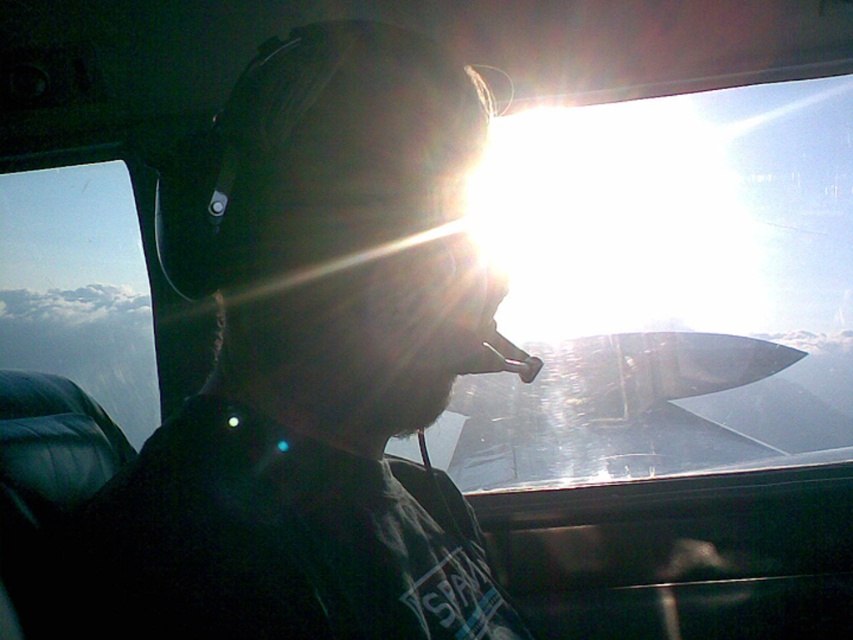
You are a GUI agent. You are given a task and a screenshot of the screen. Output one action in this format:
    pyautogui.click(x=<x>, y=<y>)
    Task: Click on the black matte helmet at center
    
    Given the screenshot: What is the action you would take?
    pyautogui.click(x=323, y=369)

Can you confirm if black matte helmet at center is positioned to the right of transparent glass airplane window at upper center?

No, black matte helmet at center is not to the right of transparent glass airplane window at upper center.

Between point (480, 108) and point (775, 198), which one is positioned behind?

The point (775, 198) is more distant.

Locate an element on the screen. black matte helmet at center is located at coordinates pos(323,369).